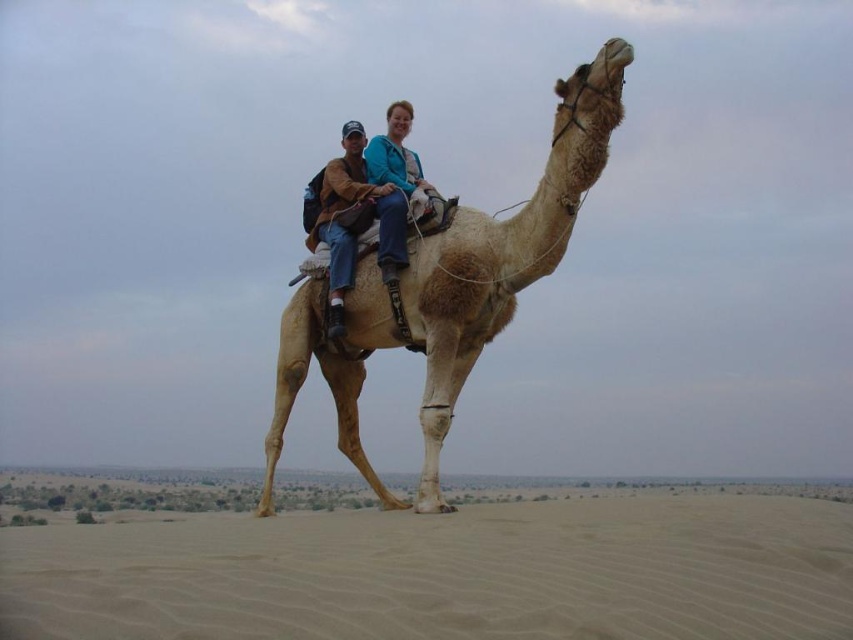
Does light beige textured camel at center have a lesser height compared to matte brown leather saddle at center?

No.

Can you confirm if light beige textured camel at center is positioned to the left of matte brown leather saddle at center?

Incorrect, light beige textured camel at center is not on the left side of matte brown leather saddle at center.

Is point (467, 248) positioned behind point (338, 164)?

No, it is in front of (338, 164).

Where is `light beige textured camel at center`? The image size is (853, 640). light beige textured camel at center is located at coordinates (503, 252).

Is light beige textured camel at center above blue textured jacket at center?

No, light beige textured camel at center is not above blue textured jacket at center.

The width and height of the screenshot is (853, 640). I want to click on light beige textured camel at center, so click(503, 252).

Identify the location of light beige textured camel at center. This screenshot has height=640, width=853. (503, 252).

Who is positioned more to the right, fine-grained sand at lower center or light beige textured camel at center?

Positioned to the right is light beige textured camel at center.

Who is shorter, fine-grained sand at lower center or light beige textured camel at center?

fine-grained sand at lower center

The height and width of the screenshot is (640, 853). Describe the element at coordinates (445, 573) in the screenshot. I see `fine-grained sand at lower center` at that location.

In order to click on fine-grained sand at lower center in this screenshot , I will do `click(445, 573)`.